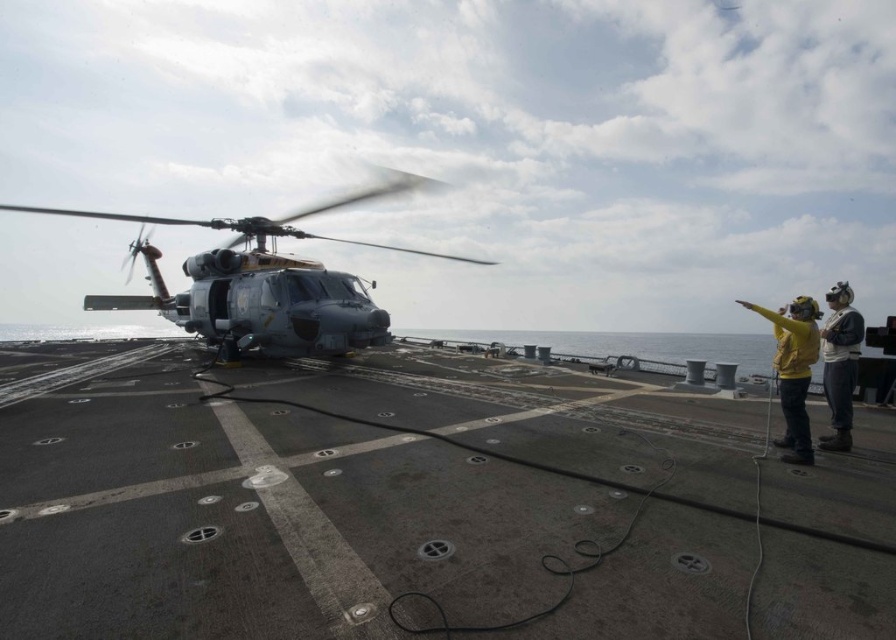
Does metallic gray helicopter at center have a greater height compared to yellow fabric jacket at right?

Yes.

Does point (240, 241) come in front of point (831, 308)?

That is False.

Where is `metallic gray helicopter at center`? The width and height of the screenshot is (896, 640). metallic gray helicopter at center is located at coordinates (265, 282).

Which of these two, metallic gray helicopter at center or yellow matte jacket at right, stands taller?

metallic gray helicopter at center

Is point (337, 285) behind point (786, 376)?

Yes, point (337, 285) is behind point (786, 376).

I want to click on metallic gray helicopter at center, so click(265, 282).

Does yellow matte jacket at right lie behind yellow fabric jacket at right?

That is False.

Is yellow matte jacket at right wider than yellow fabric jacket at right?

→ Yes.

Is point (776, 312) behind point (843, 339)?

That is True.

This screenshot has width=896, height=640. What are the coordinates of `yellow matte jacket at right` in the screenshot? It's located at [x=793, y=371].